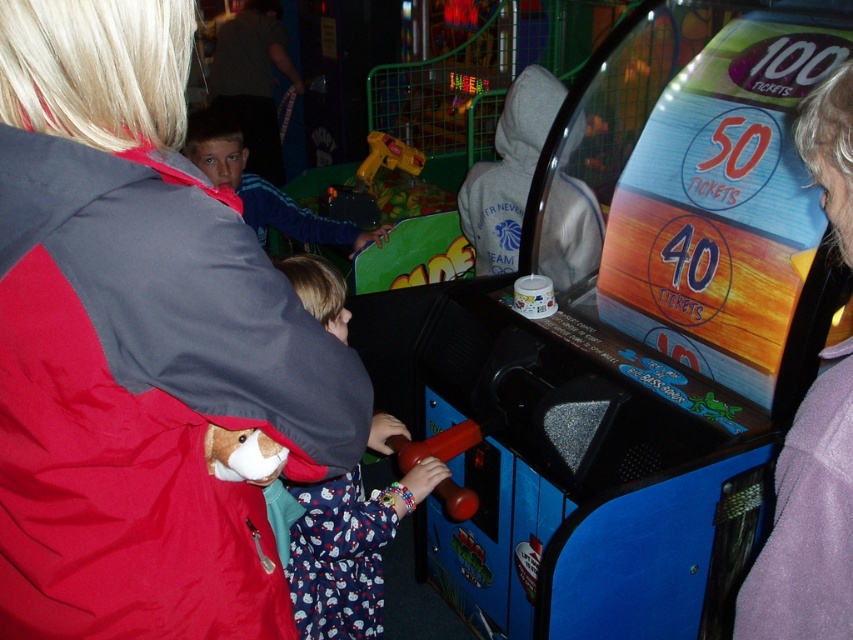
Does yellow plastic toy gun at center appear over rubberized red handle at center?

Yes.

Can you confirm if yellow plastic toy gun at center is positioned to the left of rubberized red handle at center?

Indeed, yellow plastic toy gun at center is positioned on the left side of rubberized red handle at center.

The height and width of the screenshot is (640, 853). Find the location of `yellow plastic toy gun at center`. yellow plastic toy gun at center is located at coordinates (369, 180).

Does point (822, 192) lie in front of point (344, 500)?

That is True.

Locate an element on the screen. The height and width of the screenshot is (640, 853). purple fleece jacket at lower right is located at coordinates (808, 522).

Is purple fleece jacket at lower right positioned before yellow plastic toy gun at center?

Yes, purple fleece jacket at lower right is closer to the viewer.

Is purple fleece jacket at lower right to the right of yellow plastic toy gun at center from the viewer's perspective?

Yes, purple fleece jacket at lower right is to the right of yellow plastic toy gun at center.

Describe the element at coordinates (808, 522) in the screenshot. The image size is (853, 640). I see `purple fleece jacket at lower right` at that location.

Locate an element on the screen. Image resolution: width=853 pixels, height=640 pixels. purple fleece jacket at lower right is located at coordinates (808, 522).